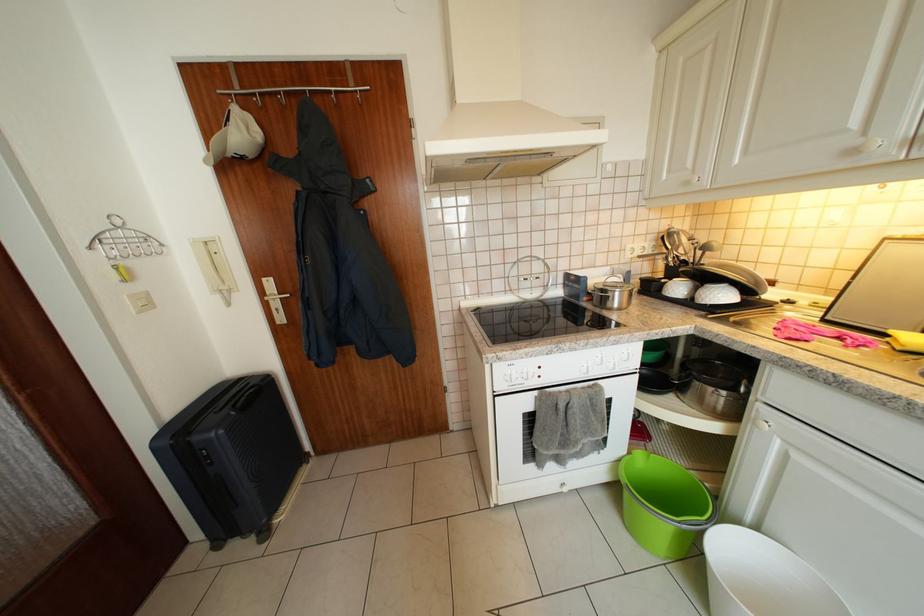
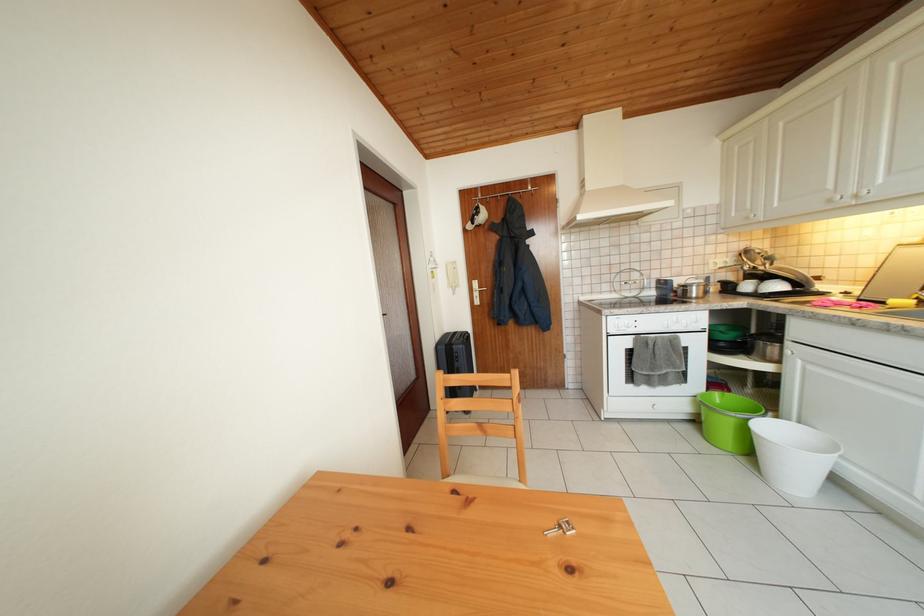
Where in the second image is the point corresponding to point (648, 459) from the first image?

(724, 399)